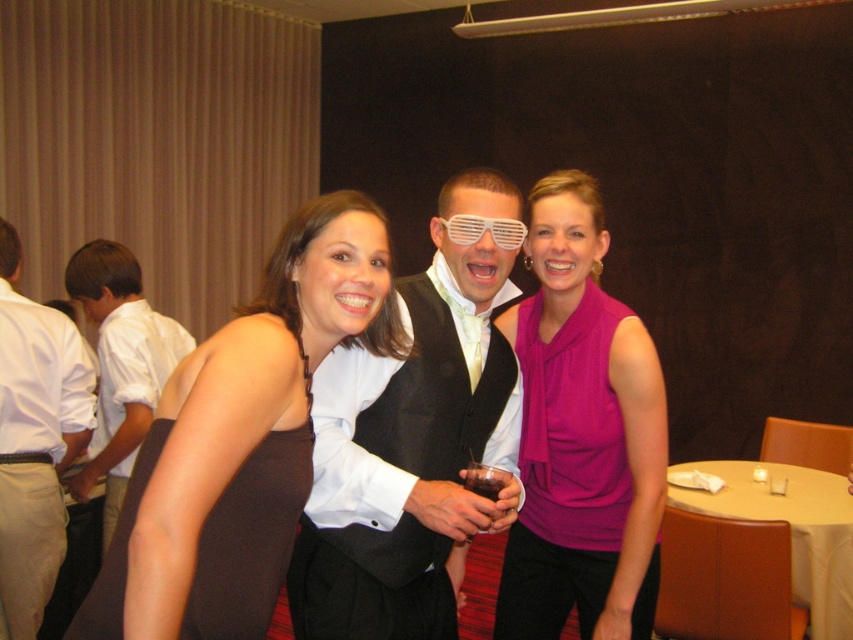
Question: Which of the following is the farthest from the observer?

Choices:
 (A) (442, 360)
 (B) (273, 593)
 (C) (468, 228)
 (D) (56, 481)

Answer: (D)

Question: Is brown satin dress at center positioned at the back of brown satin dress at lower left?

Choices:
 (A) no
 (B) yes

Answer: (A)

Question: Which object is the closest to the white plastic goggles at center?

Choices:
 (A) purple silky blouse at center
 (B) brown satin dress at lower left

Answer: (A)

Question: Is purple silky blouse at center thinner than white plastic goggles at center?

Choices:
 (A) no
 (B) yes

Answer: (A)

Question: Does brown satin dress at center come behind brown satin dress at lower left?

Choices:
 (A) no
 (B) yes

Answer: (A)

Question: Which object is positioned closest to the white glossy shirt at left?

Choices:
 (A) white shirt at left
 (B) brown satin dress at center
 (C) brown satin dress at lower left

Answer: (A)